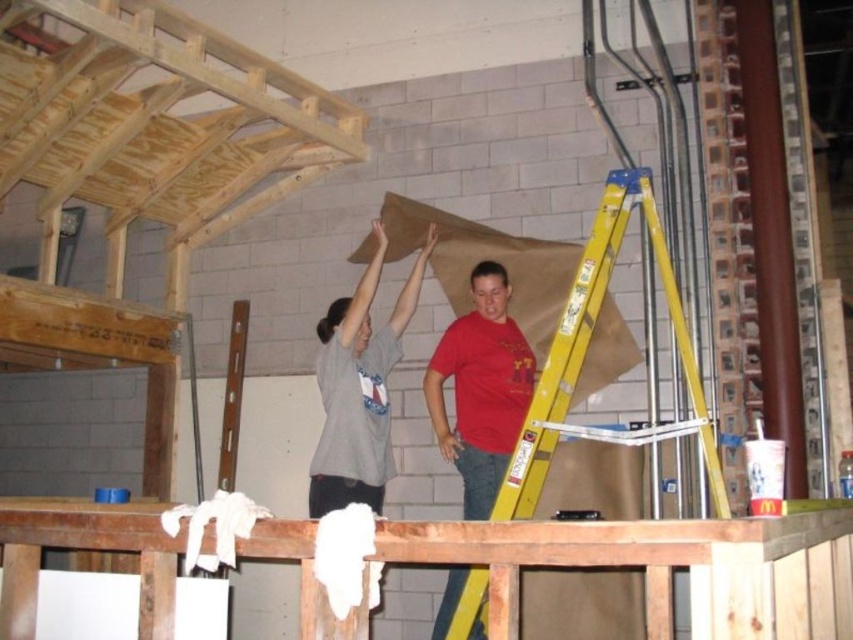
The image size is (853, 640). What do you see at coordinates (585, 353) in the screenshot?
I see `yellow/yellowish metallic ladder at center` at bounding box center [585, 353].

Can you confirm if yellow/yellowish metallic ladder at center is positioned to the left of gray cotton t-shirt at center?

No, yellow/yellowish metallic ladder at center is not to the left of gray cotton t-shirt at center.

Does point (704, 460) come closer to viewer compared to point (326, 378)?

Yes.

Where is `yellow/yellowish metallic ladder at center`? The image size is (853, 640). yellow/yellowish metallic ladder at center is located at coordinates (585, 353).

Which is below, red matte shirt at center or gray cotton t-shirt at center?

red matte shirt at center is lower down.

Describe the element at coordinates (480, 388) in the screenshot. This screenshot has width=853, height=640. I see `red matte shirt at center` at that location.

The width and height of the screenshot is (853, 640). What are the coordinates of `red matte shirt at center` in the screenshot? It's located at (480, 388).

Can you confirm if yellow/yellowish metallic ladder at center is thinner than red matte shirt at center?

Incorrect, yellow/yellowish metallic ladder at center's width is not less than red matte shirt at center's.

Does yellow/yellowish metallic ladder at center have a greater width compared to red matte shirt at center?

Correct, the width of yellow/yellowish metallic ladder at center exceeds that of red matte shirt at center.

Does point (538, 404) come farther from viewer compared to point (488, 378)?

No.

You are a GUI agent. You are given a task and a screenshot of the screen. Output one action in this format:
    pyautogui.click(x=<x>, y=<y>)
    Task: Click on the yellow/yellowish metallic ladder at center
    
    Given the screenshot: What is the action you would take?
    pyautogui.click(x=585, y=353)